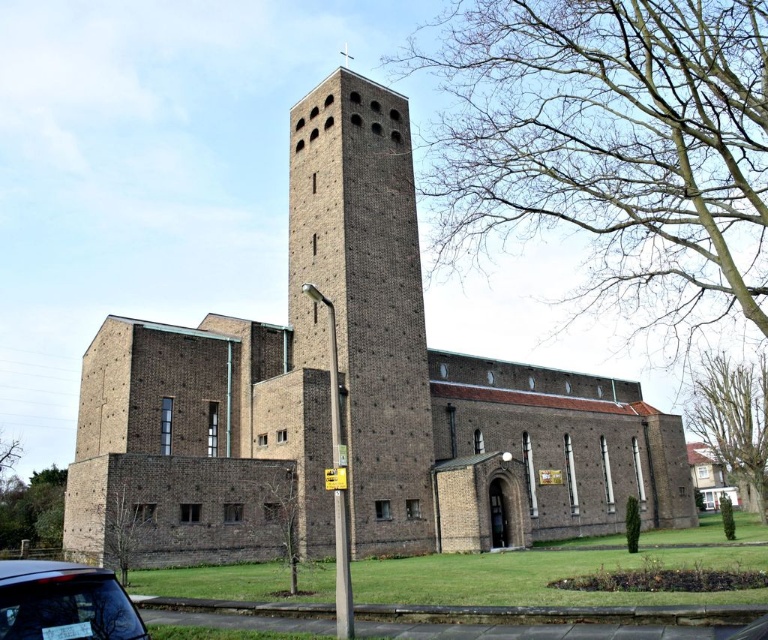
Question: Can you confirm if brown brick church at center is positioned to the right of brown brick tower at center?

Choices:
 (A) no
 (B) yes

Answer: (B)

Question: Which object is closer to the camera taking this photo?

Choices:
 (A) brown brick tower at center
 (B) brown brick church at center

Answer: (B)

Question: Does brown brick church at center have a lesser width compared to matte black car at lower left?

Choices:
 (A) no
 (B) yes

Answer: (A)

Question: Can you confirm if brown brick church at center is bigger than matte black car at lower left?

Choices:
 (A) yes
 (B) no

Answer: (A)

Question: Which object is the closest to the matte black car at lower left?

Choices:
 (A) brown brick tower at center
 (B) brown brick church at center

Answer: (A)

Question: Which is nearer to the brown brick tower at center?

Choices:
 (A) brown brick church at center
 (B) matte black car at lower left

Answer: (A)